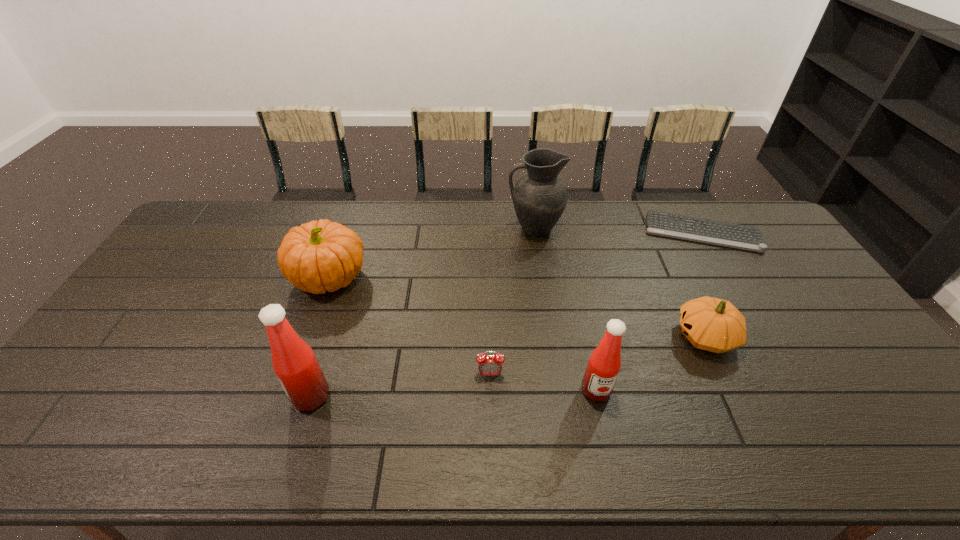
Please point a free position for a condiment on the right. Please provide its 2D coordinates. Your answer should be formatted as a tuple, i.e. [(x, y)], where the tuple contains the x and y coordinates of a point satisfying the conditions above.

[(875, 384)]